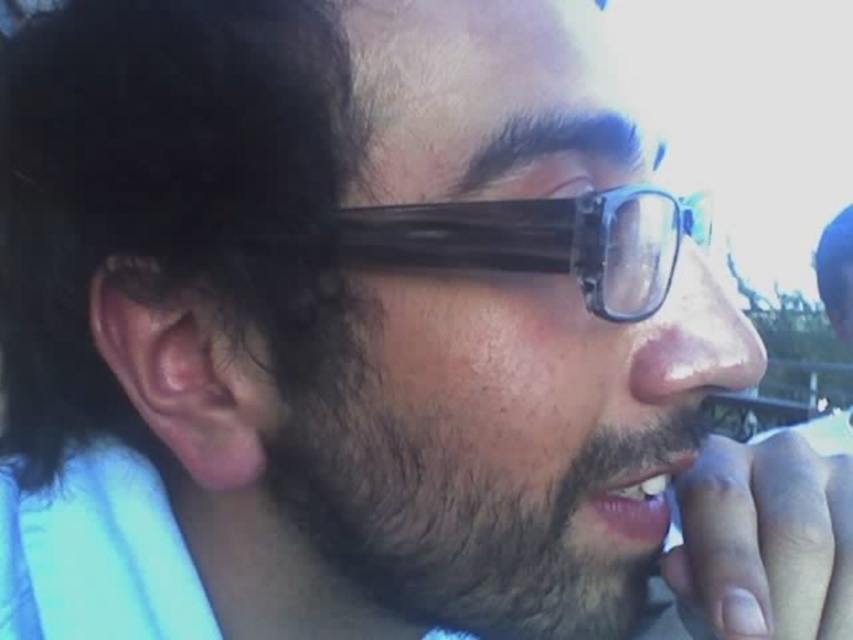
Question: Among these objects, which one is nearest to the camera?

Choices:
 (A) dark brown fuzzy beard at lower left
 (B) black plastic glasses at center
 (C) pink flesh-colored ear at left

Answer: (B)

Question: Is dark brown fuzzy beard at lower left positioned behind pink flesh-colored ear at left?

Choices:
 (A) yes
 (B) no

Answer: (B)

Question: Which point is farther to the camera?

Choices:
 (A) (601, 465)
 (B) (206, 454)
 (C) (599, 269)

Answer: (B)

Question: Does black plastic glasses at center appear over pink flesh-colored ear at left?

Choices:
 (A) yes
 (B) no

Answer: (A)

Question: Can you confirm if dark brown fuzzy beard at lower left is bigger than pink flesh-colored ear at left?

Choices:
 (A) no
 (B) yes

Answer: (B)

Question: Which object is farther from the camera taking this photo?

Choices:
 (A) pink flesh-colored ear at left
 (B) black plastic glasses at center

Answer: (A)